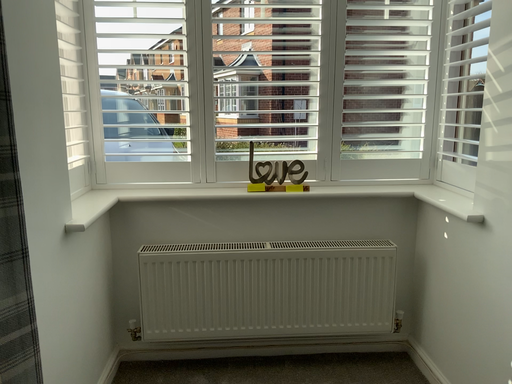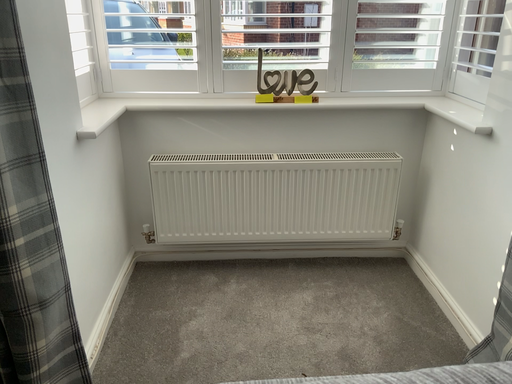
Question: Which way did the camera rotate in the video?

Choices:
 (A) rotated upward
 (B) rotated downward

Answer: (B)